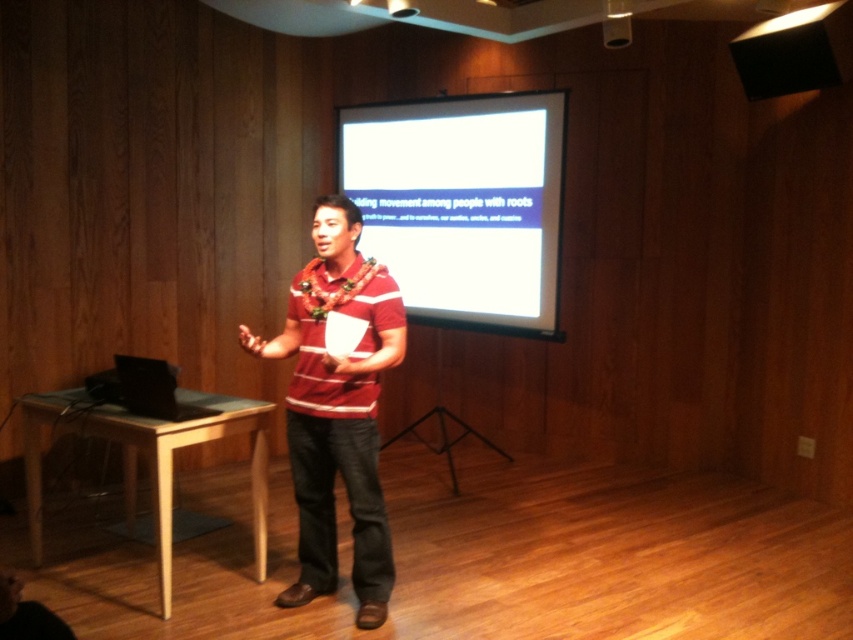
You are organizing an event and need to decide where to place a new banner. The banner is wider than the matte black speaker at upper right. Based on the scene, can the banner be placed where the white glossy projection screen at upper center is currently located?

The white glossy projection screen at upper center has a larger width than the matte black speaker at upper right. Since the banner is wider than the speaker, it can fit in the screen location as the screen is wider.

What is the position of the point with coordinates [463,204] in the presentation setting?

The point with coordinates [463,204] is located on the white glossy projection screen at upper center.

You are attending a presentation and need to locate the speaker. The speaker is wearing a matte black speaker at upper right. Where would you look relative to the matte red striped shirt at center?

The matte black speaker at upper right is to the right of the matte red striped shirt at center, so you should look to the right side of the matte red striped shirt at center to find the speaker.